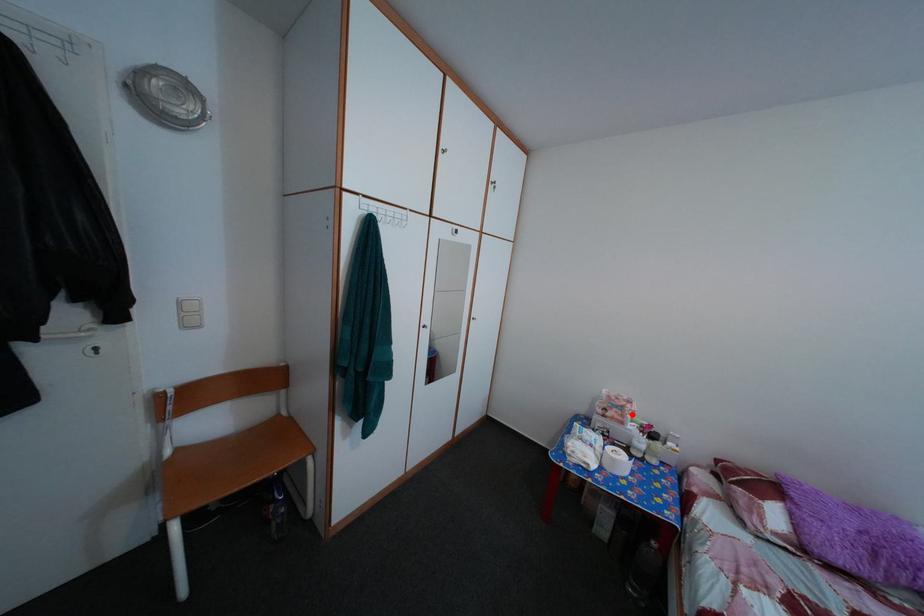
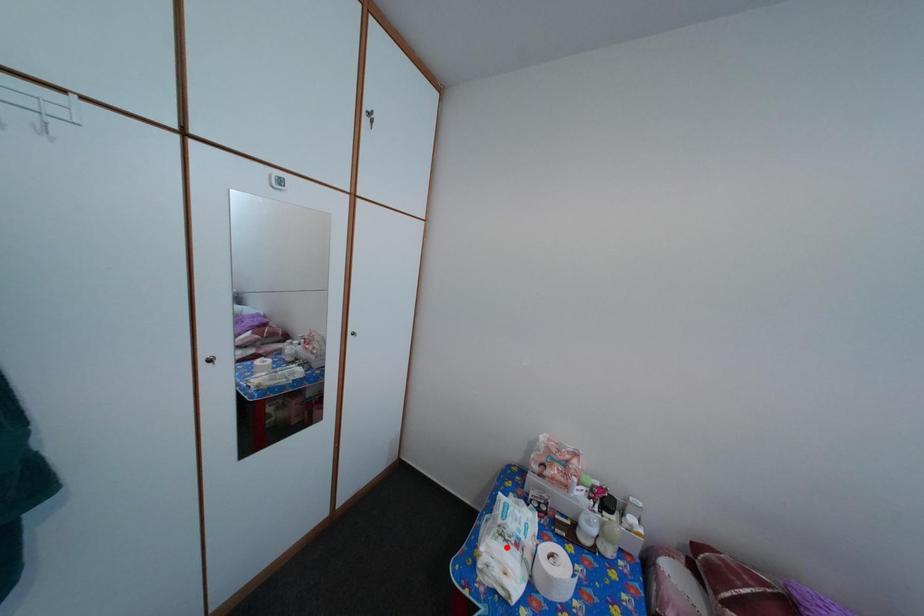
I am providing you with two images of the same scene from different viewpoints. A red point is marked on the first image and another point is marked on the second image. Is the marked point in image1 the same physical position as the marked point in image2?

No